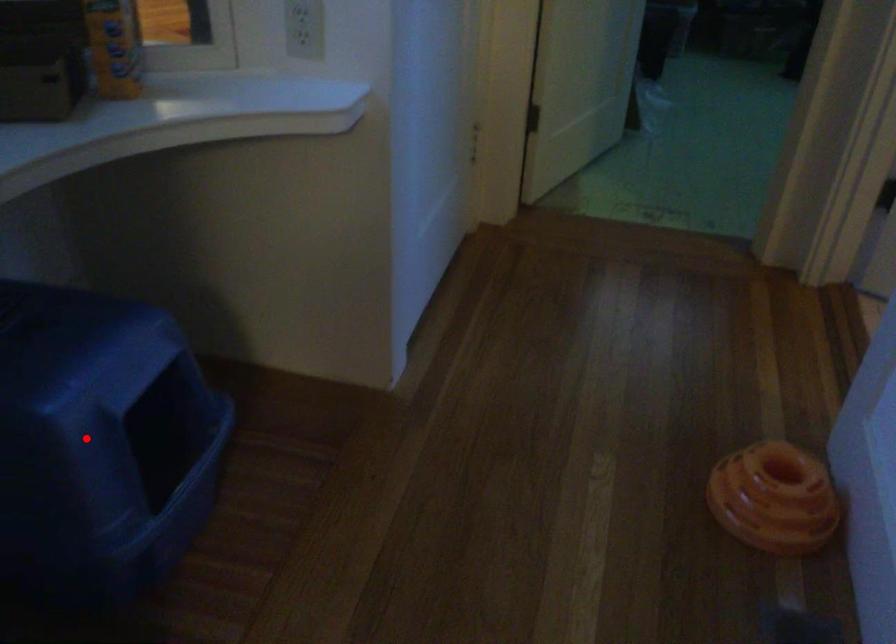
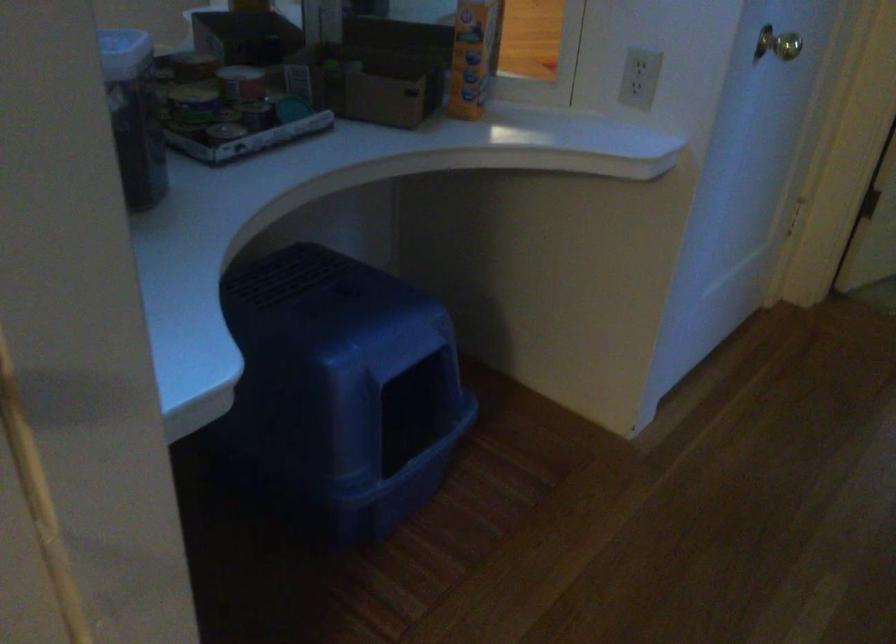
Find the pixel in the second image that matches the highlighted location in the first image.

(341, 388)